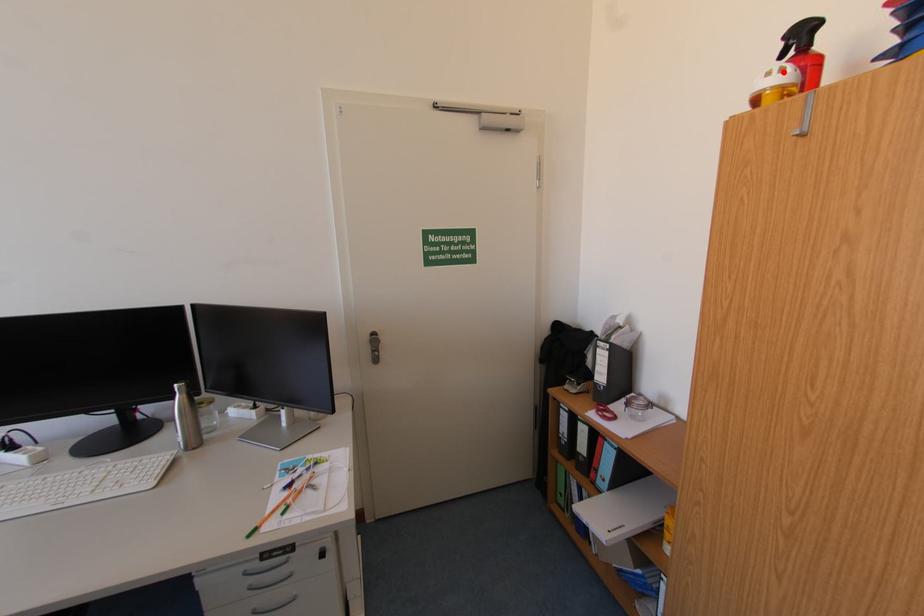
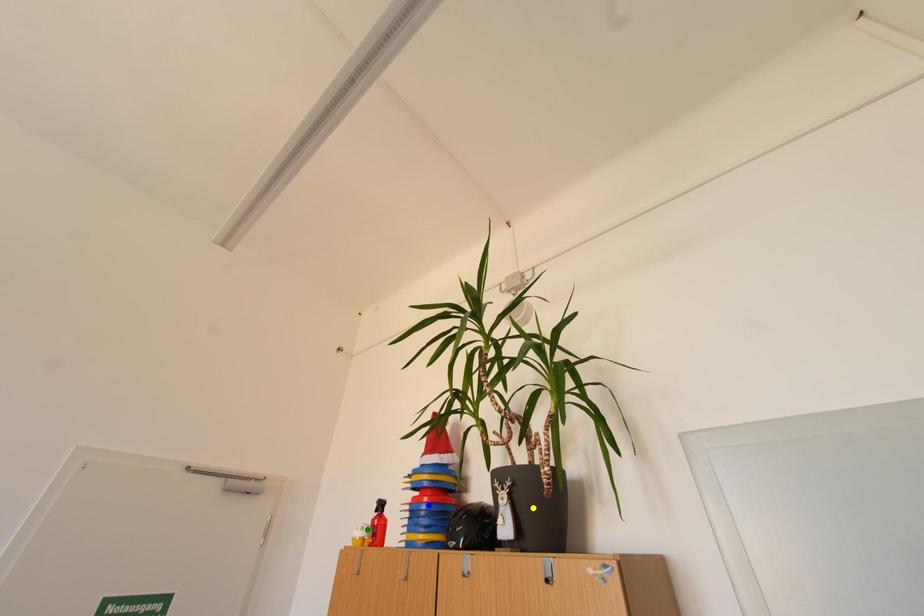
Question: I am providing you with two images of the same scene from different viewpoints. A red point is marked on the first image. You are given multiple points on the second image. Which spot in image 2 lines up with the point in image 1?

Choices:
 (A) yellow point
 (B) blue point
 (C) green point

Answer: (C)